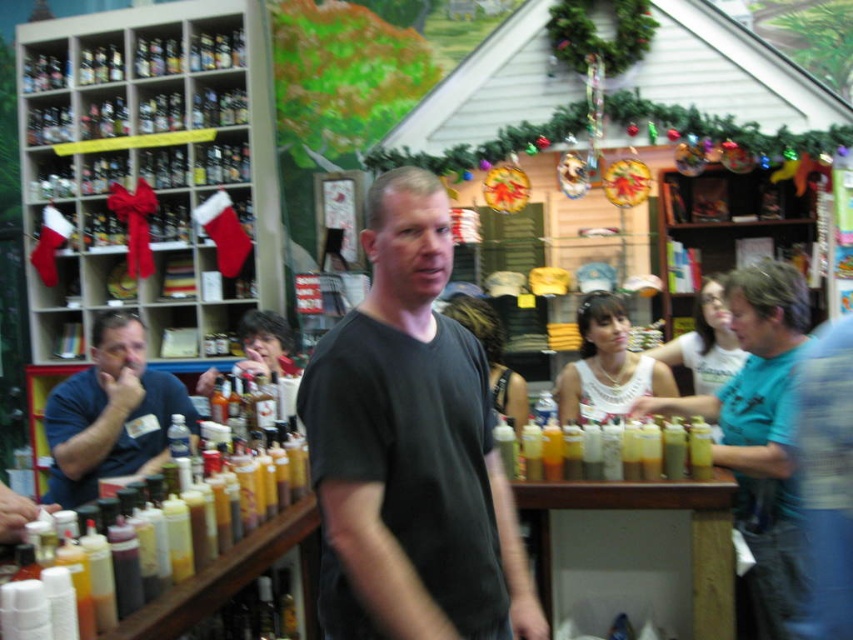
Question: Is teal matte shirt at center to the right of matte black shirt at center from the viewer's perspective?

Choices:
 (A) yes
 (B) no

Answer: (A)

Question: Can you confirm if teal matte shirt at center is bigger than blue shirt at left?

Choices:
 (A) no
 (B) yes

Answer: (B)

Question: Which object appears closest to the camera in this image?

Choices:
 (A) white lace top at center
 (B) matte white tank top at center
 (C) dark gray t-shirt at center
 (D) matte black shirt at center

Answer: (C)

Question: Which of the following is the closest to the observer?

Choices:
 (A) white matte tank top at center
 (B) matte black shirt at center

Answer: (B)

Question: Is white lace top at center to the left of matte black shirt at center from the viewer's perspective?

Choices:
 (A) yes
 (B) no

Answer: (B)

Question: Which point is closer to the camera taking this photo?

Choices:
 (A) (793, 518)
 (B) (438, 384)
 (C) (129, 456)

Answer: (B)